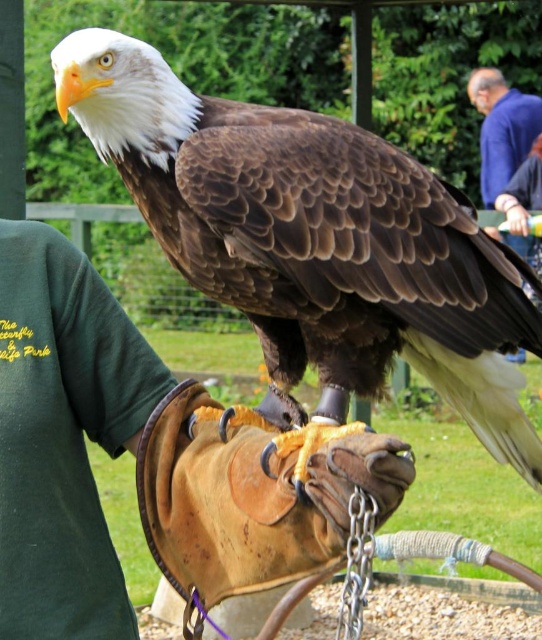
How much distance is there between brown feathered eagle at center and matte black glove at upper right?

brown feathered eagle at center and matte black glove at upper right are 5.45 meters apart.

Is brown feathered eagle at center above matte black glove at upper right?

No.

Between point (190, 266) and point (494, 230), which one is positioned in front?

Point (190, 266)

Where is `brown feathered eagle at center`? The image size is (542, 640). brown feathered eagle at center is located at coordinates (313, 241).

Is the position of brown feathered eagle at center less distant than that of green fabric arm at upper right?

That is True.

Who is lower down, brown feathered eagle at center or green fabric arm at upper right?

brown feathered eagle at center is below.

Is point (185, 90) behind point (519, 218)?

No, (185, 90) is in front of (519, 218).

Where is `brown feathered eagle at center`? The image size is (542, 640). brown feathered eagle at center is located at coordinates (313, 241).

Is point (243, 419) in front of point (518, 202)?

That is True.

Find the location of `brown leather baseball glove at center`. brown leather baseball glove at center is located at coordinates (254, 493).